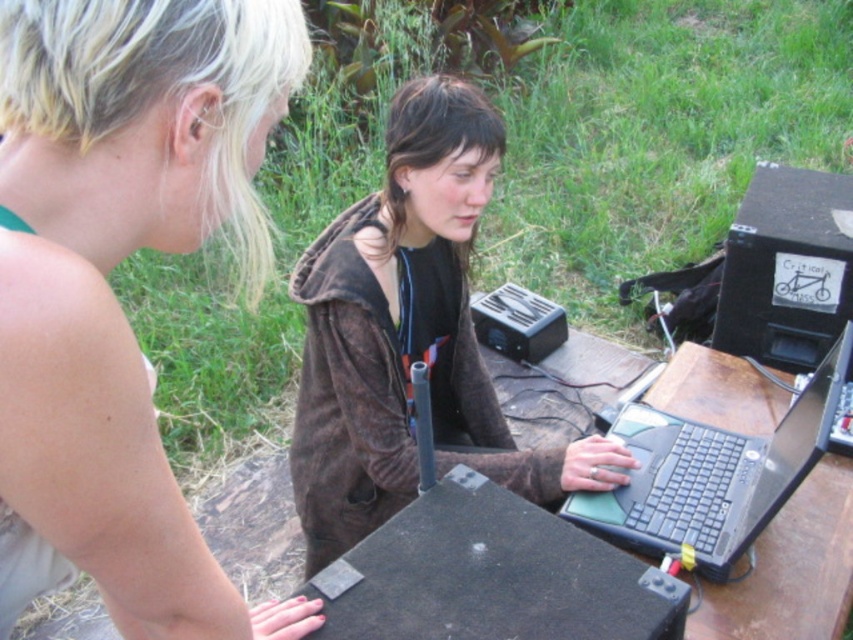
You are a photographer trying to capture a candid shot of the two people at the table. Since you want to ensure the blonde hair at upper left and the brown suede jacket at center are both visible in the frame, which object should you focus on to make sure both are in the shot?

The blonde hair at upper left is shorter than the brown suede jacket at center, so focusing on the brown suede jacket at center will ensure both objects are visible in the frame.

You are planning to place a large backpack on the table. The backpack is the same size as the brown suede jacket at center. Can the dark brown wooden picnic table at center support the backpack without it falling off?

The brown suede jacket at center is larger in size than the dark brown wooden picnic table at center. Since the backpack is the same size as the jacket, it may not fit on the table and could potentially fall off.